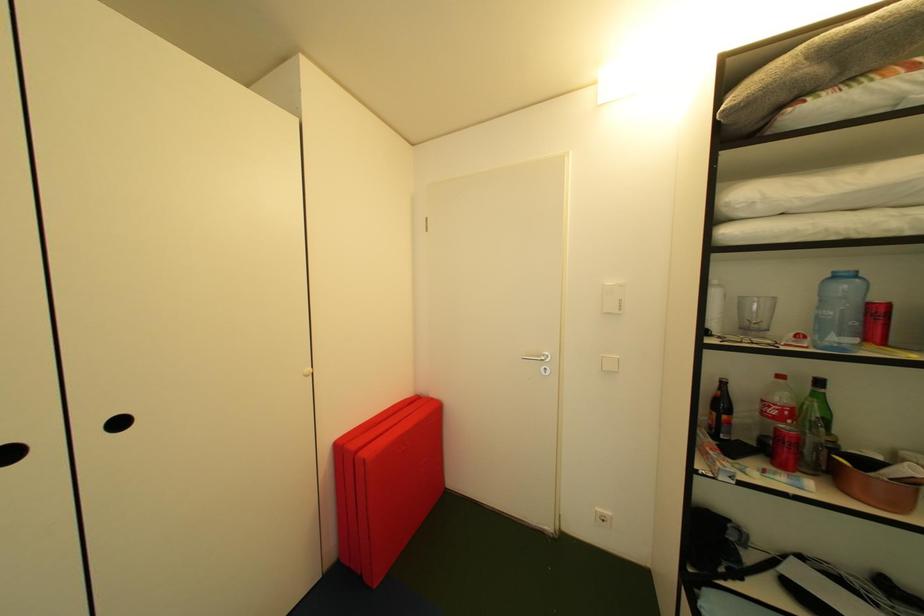
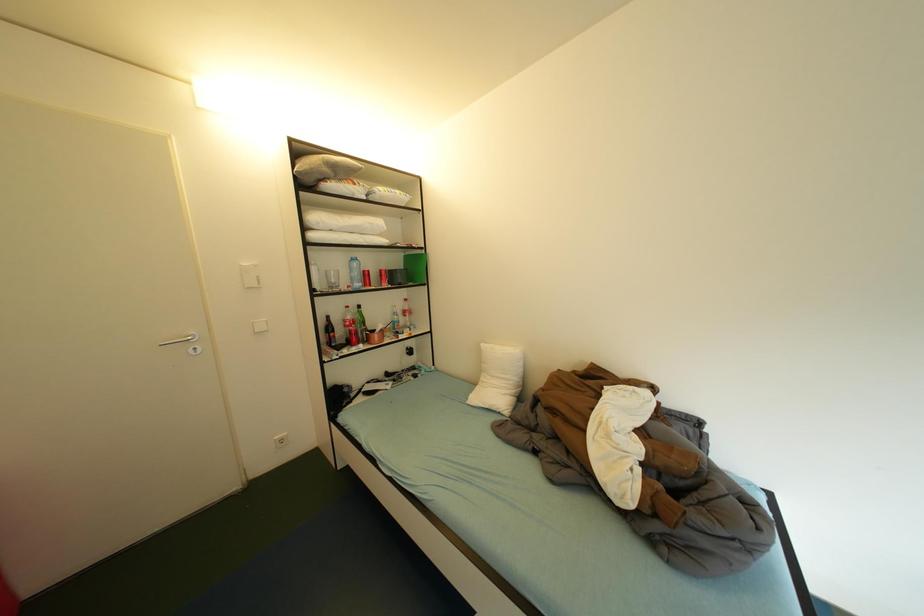
Question: The camera is either moving clockwise (left) or counter-clockwise (right) around the object. The first image is from the beginning of the video and the second image is from the end. Is the camera moving left or right when shooting the video?

Choices:
 (A) Left
 (B) Right

Answer: (A)